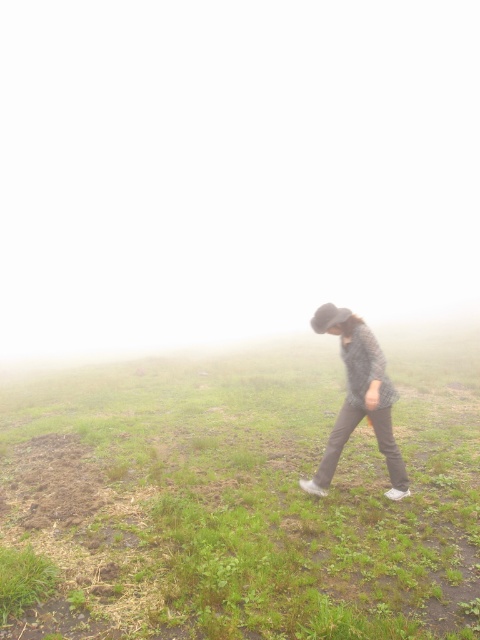
Describe the element at coordinates (248, 496) in the screenshot. This screenshot has height=640, width=480. I see `green grassy at center` at that location.

Is point (308, 397) closer to camera compared to point (379, 400)?

No, it is not.

Where is `green grassy at center`? This screenshot has height=640, width=480. green grassy at center is located at coordinates tap(248, 496).

Measure the distance between foggy mist at upper center and green grassy at lower left.

13195.90 feet

Is foggy mist at upper center to the left of green grassy at lower left from the viewer's perspective?

Correct, you'll find foggy mist at upper center to the left of green grassy at lower left.

Between point (289, 188) and point (16, 616), which one is positioned behind?

Positioned behind is point (289, 188).

Find the location of a particular element. This screenshot has width=480, height=640. foggy mist at upper center is located at coordinates (231, 168).

Which is more to the left, foggy mist at upper center or plaid fabric shirt at center?

From the viewer's perspective, foggy mist at upper center appears more on the left side.

Between foggy mist at upper center and plaid fabric shirt at center, which one is positioned lower?

Positioned lower is plaid fabric shirt at center.

Which is behind, point (216, 296) or point (377, 358)?

The point (216, 296) is more distant.

Where is `foggy mist at upper center`? The image size is (480, 640). foggy mist at upper center is located at coordinates (231, 168).